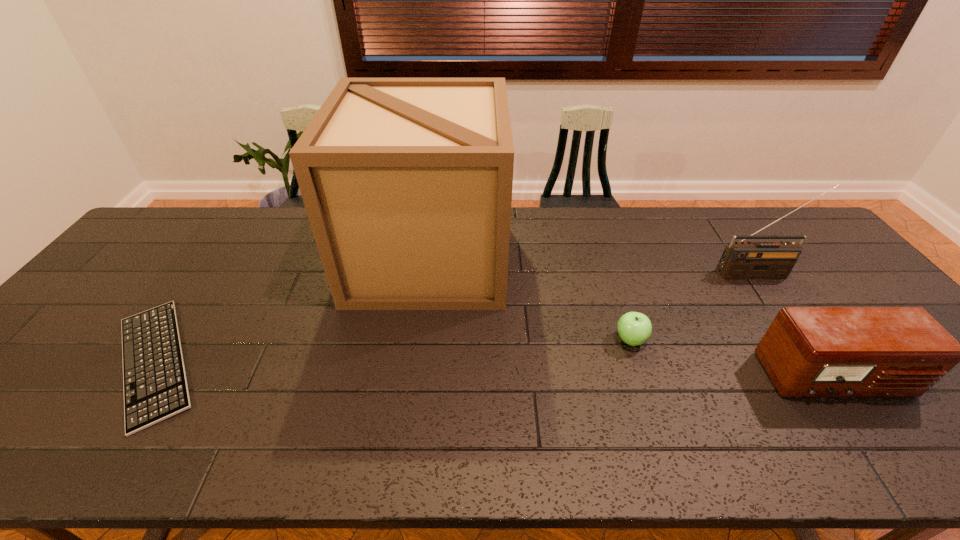
Find the location of a particular element. the fourth object from right to left is located at coordinates (407, 182).

Where is `the tallest object`? The height and width of the screenshot is (540, 960). the tallest object is located at coordinates (407, 182).

The height and width of the screenshot is (540, 960). Find the location of `the farther radio receiver`. the farther radio receiver is located at coordinates (740, 260).

In order to click on the taller radio receiver in this screenshot , I will do `click(740, 260)`.

Identify the location of the third shortest object. This screenshot has width=960, height=540. (807, 351).

Locate an element on the screen. the shorter radio receiver is located at coordinates (807, 351).

Where is `the third object from left to right`? the third object from left to right is located at coordinates (634, 328).

Image resolution: width=960 pixels, height=540 pixels. In order to click on apple in this screenshot , I will do `click(634, 328)`.

This screenshot has height=540, width=960. In order to click on the shortest object in this screenshot , I will do `click(155, 386)`.

This screenshot has height=540, width=960. What are the coordinates of `computer keyboard` in the screenshot? It's located at (155, 386).